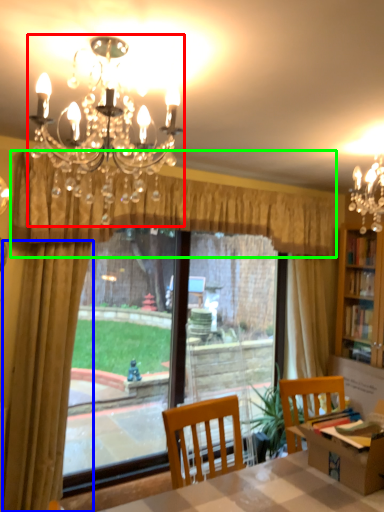
Question: Which object is positioned farthest from lamp (highlighted by a red box)? Select from curtain (highlighted by a blue box) and curtain (highlighted by a green box).

Choices:
 (A) curtain
 (B) curtain

Answer: (A)